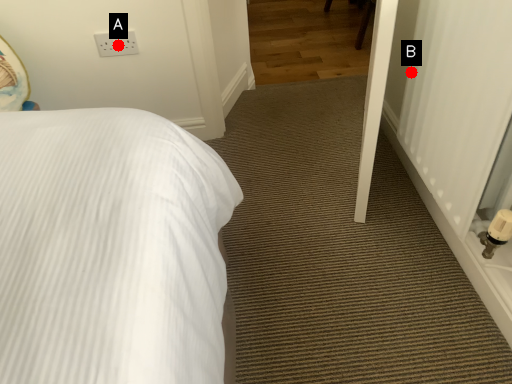
Question: Two points are circled on the image, labeled by A and B beside each circle. Among these points, which one is farthest from the camera?

Choices:
 (A) A is further
 (B) B is further

Answer: (A)